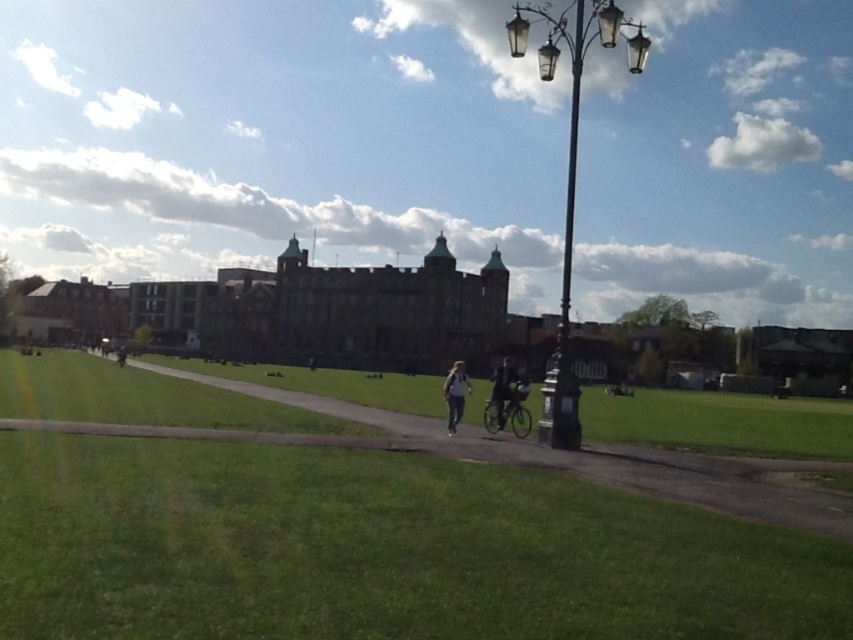
Is point (447, 413) positioned behind point (119, 364)?

No.

Is white fabric jacket at center taller than dark gray jacket at center?

Indeed, white fabric jacket at center has a greater height compared to dark gray jacket at center.

I want to click on white fabric jacket at center, so click(x=456, y=394).

Locate an element on the screen. The width and height of the screenshot is (853, 640). white fabric jacket at center is located at coordinates (456, 394).

Find the location of a particular element. matte brown building at center is located at coordinates (276, 136).

Does matte brown building at center appear on the left side of dark gray jacket at center?

In fact, matte brown building at center is to the right of dark gray jacket at center.

Which is in front, point (392, 161) or point (125, 356)?

Positioned in front is point (125, 356).

The width and height of the screenshot is (853, 640). Identify the location of matte brown building at center. (276, 136).

Is green grass at center closer to camera compared to dark gray jacket at center?

Yes, it is in front of dark gray jacket at center.

Is green grass at center taller than dark gray jacket at center?

In fact, green grass at center may be shorter than dark gray jacket at center.

This screenshot has width=853, height=640. What do you see at coordinates (599, 461) in the screenshot?
I see `green grass at center` at bounding box center [599, 461].

Locate an element on the screen. The width and height of the screenshot is (853, 640). green grass at center is located at coordinates (599, 461).